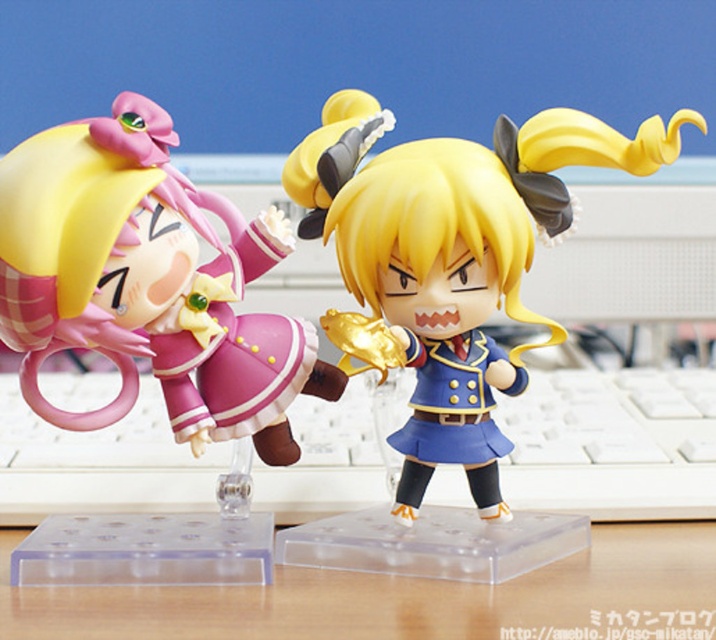
You are organizing a desk and want to place a matte pink plastic toy at left and a shiny silver robot figurine at right. The desk has a coordinate system where the bottom left corner is the origin. The toy is at point (147, 282). If you want to place the robot figurine exactly 0.1 units to the right of the toy, what would be the new coordinates for the robot figurine?

The new coordinates for the shiny silver robot figurine would be 0.542, 0.207 because adding 0.1 to the x coordinate of the matte pink plastic toy at left located at (147, 282) moves it 0.1 units to the right while keeping the y coordinate the same.

You are setting up a small display on your desk. You have a white plastic keyboard at center and a wooden table at center. Which object should you place first if you want to ensure there is enough space for both?

You should place the wooden table at center first because the white plastic keyboard at center is larger in size than the wooden table at center, so placing the smaller item first allows more flexibility for positioning the larger keyboard afterward.